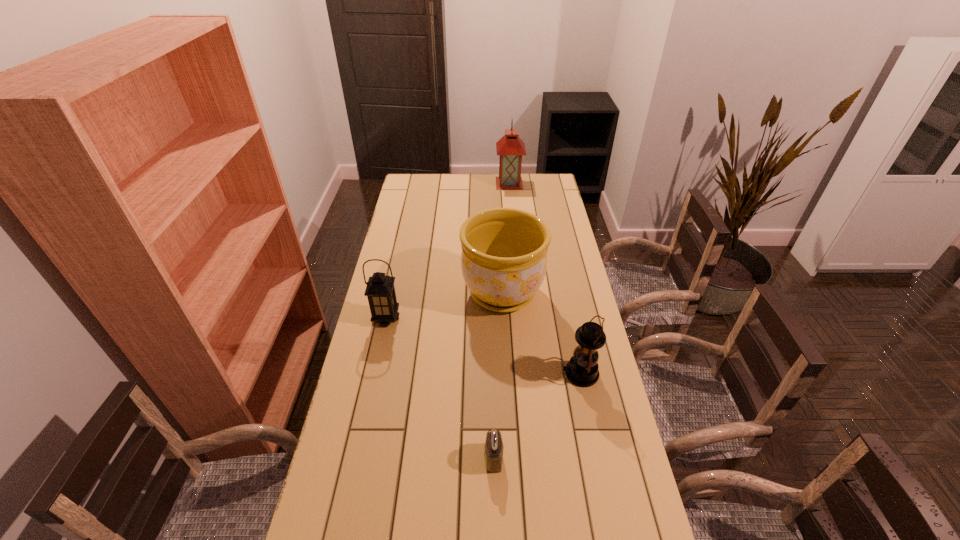
Where is `vacant space that is in between the shortest object and the second nearest object`? This screenshot has height=540, width=960. vacant space that is in between the shortest object and the second nearest object is located at coordinates (537, 416).

Locate an element on the screen. Image resolution: width=960 pixels, height=540 pixels. vacant area that lies between the flowerpot and the nearest object is located at coordinates (498, 375).

Where is `vacant region between the flowerpot and the rightmost lantern`? The height and width of the screenshot is (540, 960). vacant region between the flowerpot and the rightmost lantern is located at coordinates (541, 333).

Identify the location of free space between the leftmost lantern and the farthest object. (447, 251).

Identify the location of free space that is in between the rightmost object and the farthest object. (544, 278).

Identify which object is the fourth closest to the tallest lantern. Please provide its 2D coordinates. Your answer should be formatted as a tuple, i.e. [(x, y)], where the tuple contains the x and y coordinates of a point satisfying the conditions above.

[(494, 447)]

Choose which object is the nearest neighbor to the flowerpot. Please provide its 2D coordinates. Your answer should be formatted as a tuple, i.e. [(x, y)], where the tuple contains the x and y coordinates of a point satisfying the conditions above.

[(582, 370)]

Identify which lantern is located as the third nearest to the padlock. Please provide its 2D coordinates. Your answer should be formatted as a tuple, i.e. [(x, y)], where the tuple contains the x and y coordinates of a point satisfying the conditions above.

[(510, 147)]

The image size is (960, 540). Identify the location of lantern object that ranks as the second closest to the farthest object. (582, 370).

In order to click on vacant space that satisfies the following two spatial constraints: 1. on the back side of the flowerpot; 2. on the right side of the farthest object in this screenshot , I will do `click(496, 183)`.